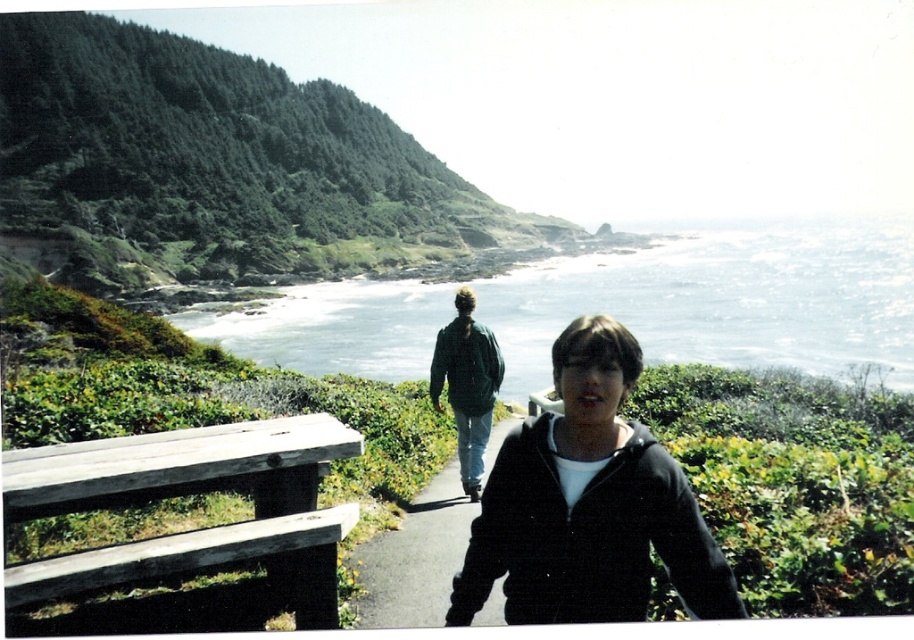
Question: Does clear blue water at center appear on the left side of green matte jacket at center?

Choices:
 (A) yes
 (B) no

Answer: (B)

Question: Is black asphalt path at center thinner than green matte jacket at center?

Choices:
 (A) yes
 (B) no

Answer: (A)

Question: Which is farther from the green matte jacket at center?

Choices:
 (A) black asphalt path at center
 (B) black matte jacket at center
 (C) clear blue water at center

Answer: (C)

Question: Which point is farther to the camera?

Choices:
 (A) green matte jacket at center
 (B) clear blue water at center
 (C) black matte jacket at center
 (D) black asphalt path at center

Answer: (B)

Question: Which of the following is the farthest from the observer?

Choices:
 (A) (663, 467)
 (B) (749, 289)
 (C) (410, 620)

Answer: (B)

Question: From the image, what is the correct spatial relationship of black matte jacket at center in relation to black asphalt path at center?

Choices:
 (A) right
 (B) left

Answer: (A)